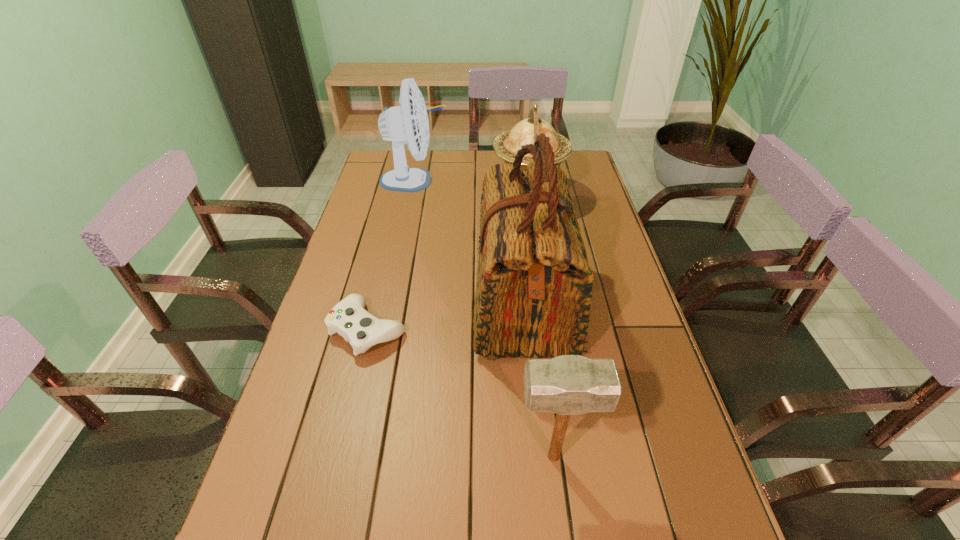
Image resolution: width=960 pixels, height=540 pixels. I want to click on shopping bag present at the right edge, so click(533, 293).

Image resolution: width=960 pixels, height=540 pixels. In order to click on globe that is at the right edge in this screenshot , I will do `click(506, 145)`.

Image resolution: width=960 pixels, height=540 pixels. In order to click on object that is at the far left corner in this screenshot , I will do `click(408, 123)`.

At what (x,y) coordinates should I click in order to perform the action: click on object located in the far right corner section of the desktop. Please return your answer as a coordinate pair (x, y). This screenshot has height=540, width=960. Looking at the image, I should click on (506, 145).

At what (x,y) coordinates should I click in order to perform the action: click on free space at the far edge of the desktop. Please return your answer as a coordinate pair (x, y). Looking at the image, I should click on (436, 181).

Find the location of a particular element. The image size is (960, 540). free point at the left edge is located at coordinates (348, 403).

In the image, there is a desktop. In order to click on vacant space at the right edge in this screenshot , I will do `click(650, 337)`.

In order to click on vacant region at the far right corner of the desktop in this screenshot , I will do `click(573, 151)`.

This screenshot has width=960, height=540. What are the coordinates of `free space between the globe and the control` in the screenshot? It's located at (448, 262).

This screenshot has width=960, height=540. What are the coordinates of `free space between the fan and the globe` in the screenshot? It's located at (471, 187).